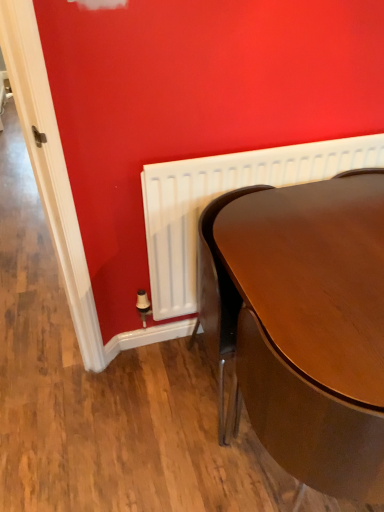
The height and width of the screenshot is (512, 384). Identify the location of glossy wood table at right. (303, 323).

Describe the element at coordinates (303, 323) in the screenshot. I see `glossy wood table at right` at that location.

Find the location of `white plastic radiator at lower left`. white plastic radiator at lower left is located at coordinates (221, 194).

What is the approximate width of white plastic radiator at lower left?

2.17 inches.

The image size is (384, 512). Describe the element at coordinates (221, 194) in the screenshot. I see `white plastic radiator at lower left` at that location.

This screenshot has width=384, height=512. In order to click on glossy wood table at right in this screenshot , I will do `click(303, 323)`.

Which object is positioned more to the left, glossy wood table at right or white plastic radiator at lower left?

white plastic radiator at lower left is more to the left.

Considering the positions of objects glossy wood table at right and white plastic radiator at lower left in the image provided, who is in front, glossy wood table at right or white plastic radiator at lower left?

glossy wood table at right is closer to the camera.

Is point (339, 213) positioned after point (230, 167)?

No, (339, 213) is in front of (230, 167).

From the image's perspective, is glossy wood table at right on white plastic radiator at lower left?

No, from the image's perspective, glossy wood table at right is not over white plastic radiator at lower left.

From a real-world perspective, between glossy wood table at right and white plastic radiator at lower left, who is vertically lower?

From a 3D spatial view, glossy wood table at right is below.

Can you confirm if glossy wood table at right is wider than white plastic radiator at lower left?

Indeed, glossy wood table at right has a greater width compared to white plastic radiator at lower left.

Considering the sizes of objects glossy wood table at right and white plastic radiator at lower left in the image provided, who is taller, glossy wood table at right or white plastic radiator at lower left?

glossy wood table at right is taller.

Considering the sizes of glossy wood table at right and white plastic radiator at lower left in the image, is glossy wood table at right bigger or smaller than white plastic radiator at lower left?

In the image, glossy wood table at right appears to be larger than white plastic radiator at lower left.

Is glossy wood table at right inside or outside of white plastic radiator at lower left?

The correct answer is: outside.

Are glossy wood table at right and white plastic radiator at lower left far apart?

That's not correct — glossy wood table at right is a little close to white plastic radiator at lower left.

Does glossy wood table at right turn towards white plastic radiator at lower left?

No, glossy wood table at right is not turned towards white plastic radiator at lower left.

Where is `radiator behind the glossy wood table at right`? This screenshot has height=512, width=384. radiator behind the glossy wood table at right is located at coordinates [221, 194].

Which object is positioned more to the left, white plastic radiator at lower left or glossy wood table at right?

white plastic radiator at lower left is more to the left.

Is white plastic radiator at lower left further to the viewer compared to glossy wood table at right?

Yes, white plastic radiator at lower left is further from the viewer.

Between point (155, 246) and point (374, 383), which one is positioned behind?

Positioned behind is point (155, 246).

From the image's perspective, is white plastic radiator at lower left located beneath glossy wood table at right?

No, from the image's perspective, white plastic radiator at lower left is not beneath glossy wood table at right.

From a real-world perspective, is white plastic radiator at lower left physically above glossy wood table at right?

Yes, from a real-world perspective, white plastic radiator at lower left is on top of glossy wood table at right.

Can you confirm if white plastic radiator at lower left is thinner than glossy wood table at right?

Indeed, white plastic radiator at lower left has a lesser width compared to glossy wood table at right.

Is white plastic radiator at lower left shorter than glossy wood table at right?

Yes.

Who is bigger, white plastic radiator at lower left or glossy wood table at right?

glossy wood table at right.

Choose the correct answer: Is white plastic radiator at lower left inside glossy wood table at right or outside it?

white plastic radiator at lower left cannot be found inside glossy wood table at right.

Is white plastic radiator at lower left touching glossy wood table at right?

No, white plastic radiator at lower left is not with glossy wood table at right.

Is glossy wood table at right at the back of white plastic radiator at lower left?

Yes, white plastic radiator at lower left's orientation is away from glossy wood table at right.

Where is `radiator lying on the left of glossy wood table at right`? radiator lying on the left of glossy wood table at right is located at coordinates (221, 194).

I want to click on table in front of the white plastic radiator at lower left, so click(303, 323).

At what (x,y) coordinates should I click in order to perform the action: click on table below the white plastic radiator at lower left (from a real-world perspective). Please return your answer as a coordinate pair (x, y). The height and width of the screenshot is (512, 384). Looking at the image, I should click on (303, 323).